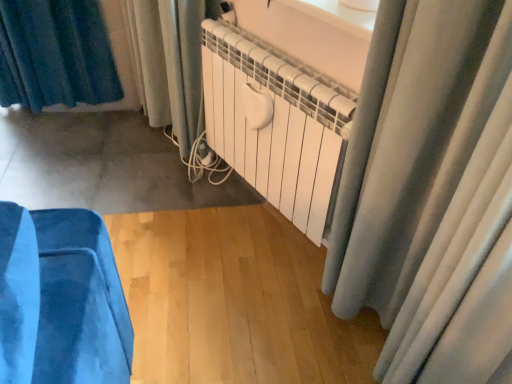
At what (x,y) coordinates should I click in order to perform the action: click on white matte radiator at center. Please return your answer as a coordinate pair (x, y). Looking at the image, I should click on (274, 126).

The height and width of the screenshot is (384, 512). Describe the element at coordinates (274, 126) in the screenshot. I see `white matte radiator at center` at that location.

Identify the location of white matte radiator at center. This screenshot has height=384, width=512. (274, 126).